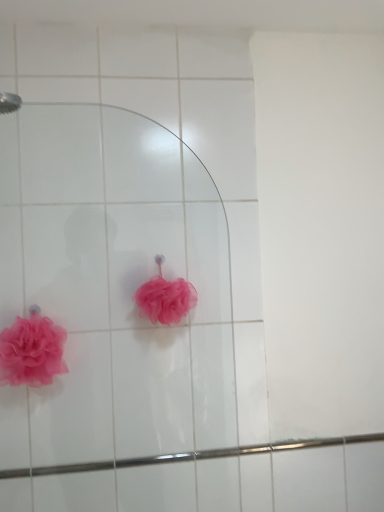
Question: Which direction should I rotate to look at pink fluffy loofah at center, arranged as the first flower when viewed from the right, — up or down?

Choices:
 (A) up
 (B) down

Answer: (B)

Question: Is matte pink loofah at lower left, the 2th flower positioned from the right, directly adjacent to pink fluffy loofah at center, which ranks as the second flower in left-to-right order?

Choices:
 (A) no
 (B) yes

Answer: (A)

Question: From the image's perspective, is matte pink loofah at lower left, which is counted as the first flower, starting from the left, on pink fluffy loofah at center, which ranks as the second flower in left-to-right order?

Choices:
 (A) no
 (B) yes

Answer: (A)

Question: Does matte pink loofah at lower left, which is counted as the first flower, starting from the left, have a lesser height compared to pink fluffy loofah at center, arranged as the first flower when viewed from the right?

Choices:
 (A) no
 (B) yes

Answer: (A)

Question: From a real-world perspective, is matte pink loofah at lower left, the 2th flower positioned from the right, positioned under pink fluffy loofah at center, which ranks as the second flower in left-to-right order, based on gravity?

Choices:
 (A) no
 (B) yes

Answer: (B)

Question: Would you say matte pink loofah at lower left, the 2th flower positioned from the right, contains pink fluffy loofah at center, which ranks as the second flower in left-to-right order?

Choices:
 (A) yes
 (B) no

Answer: (B)

Question: Is matte pink loofah at lower left, the 2th flower positioned from the right, positioned with its back to pink fluffy loofah at center, arranged as the first flower when viewed from the right?

Choices:
 (A) no
 (B) yes

Answer: (A)

Question: Is pink fluffy loofah at center, arranged as the first flower when viewed from the right, far away from matte pink loofah at lower left, which is counted as the first flower, starting from the left?

Choices:
 (A) yes
 (B) no

Answer: (B)

Question: Does pink fluffy loofah at center, which ranks as the second flower in left-to-right order, appear on the left side of matte pink loofah at lower left, which is counted as the first flower, starting from the left?

Choices:
 (A) no
 (B) yes

Answer: (A)

Question: Is the position of pink fluffy loofah at center, which ranks as the second flower in left-to-right order, more distant than that of matte pink loofah at lower left, the 2th flower positioned from the right?

Choices:
 (A) yes
 (B) no

Answer: (A)

Question: Is pink fluffy loofah at center, arranged as the first flower when viewed from the right, closer to the viewer compared to matte pink loofah at lower left, which is counted as the first flower, starting from the left?

Choices:
 (A) yes
 (B) no

Answer: (B)

Question: From the image's perspective, is pink fluffy loofah at center, arranged as the first flower when viewed from the right, located beneath matte pink loofah at lower left, which is counted as the first flower, starting from the left?

Choices:
 (A) yes
 (B) no

Answer: (B)

Question: Is pink fluffy loofah at center, arranged as the first flower when viewed from the right, positioned with its back to matte pink loofah at lower left, the 2th flower positioned from the right?

Choices:
 (A) no
 (B) yes

Answer: (A)

Question: Does point (56, 340) appear closer or farther from the camera than point (170, 282)?

Choices:
 (A) farther
 (B) closer

Answer: (B)